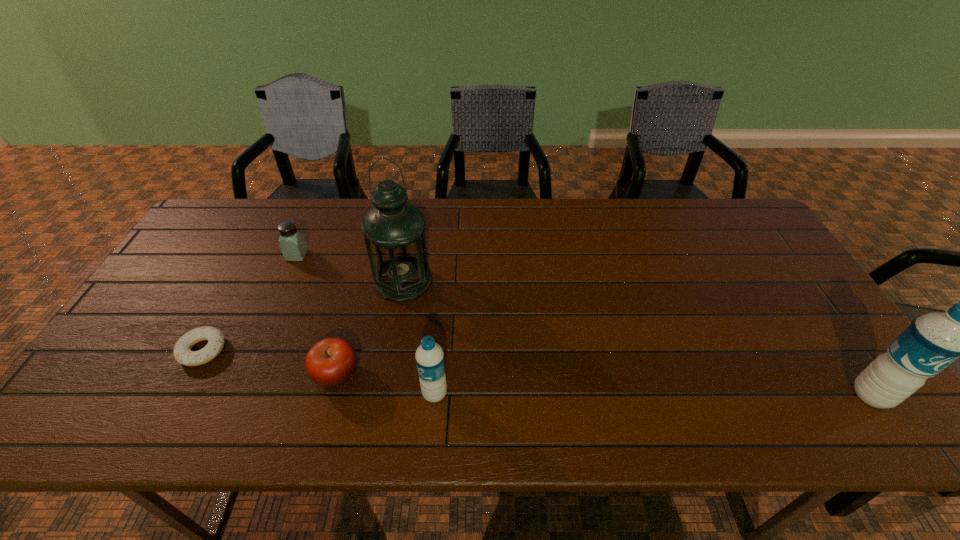
Please mark a free spot for a new water_bottle to balance the arrangement. Please provide its 2D coordinates. Your answer should be formatted as a tuple, i.e. [(x, y)], where the tuple contains the x and y coordinates of a point satisfying the conditions above.

[(653, 394)]